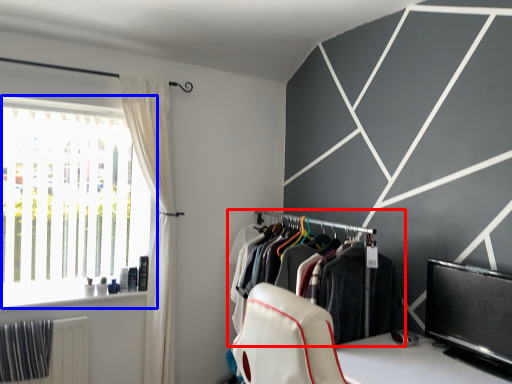
Question: Among these objects, which one is nearest to the camera, closet (highlighted by a red box) or window (highlighted by a blue box)?

Choices:
 (A) closet
 (B) window

Answer: (A)